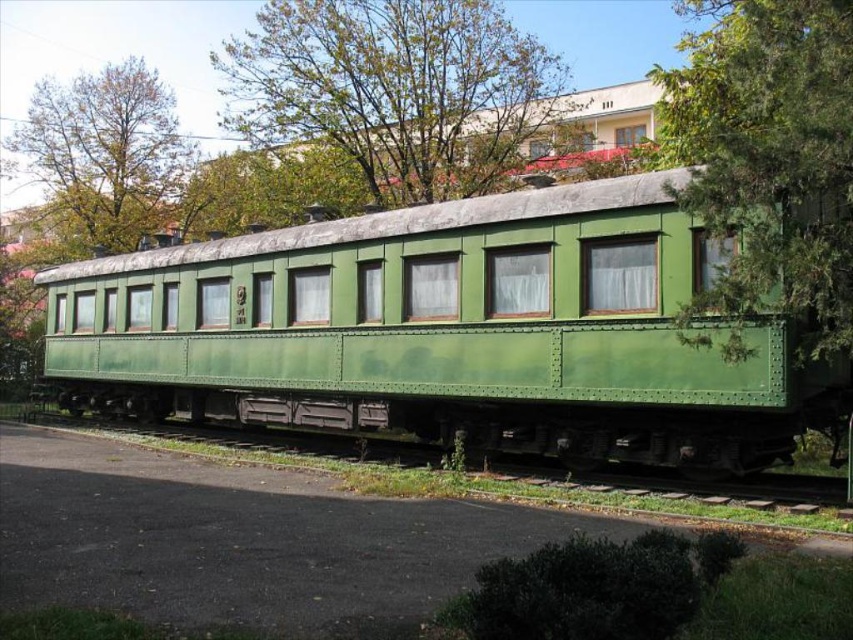
Between green matte train car at center and green leafy tree at upper left, which one has less height?

green matte train car at center is shorter.

Can you confirm if green matte train car at center is taller than green leafy tree at upper left?

In fact, green matte train car at center may be shorter than green leafy tree at upper left.

Who is more distant from viewer, (x=97, y=291) or (x=149, y=148)?

Positioned behind is point (x=149, y=148).

The height and width of the screenshot is (640, 853). I want to click on green matte train car at center, so click(448, 332).

Does green textured tree at upper right appear under green leafy tree at upper center?

Yes, green textured tree at upper right is below green leafy tree at upper center.

Is green textured tree at upper right positioned before green leafy tree at upper center?

Yes.

Does point (700, 58) come farther from viewer compared to point (509, 154)?

No, (700, 58) is in front of (509, 154).

Locate an element on the screen. Image resolution: width=853 pixels, height=640 pixels. green textured tree at upper right is located at coordinates (770, 157).

Which is more to the left, green textured tree at upper right or green leafy tree at upper left?

green leafy tree at upper left is more to the left.

Is the position of green textured tree at upper right more distant than that of green leafy tree at upper left?

No, it is in front of green leafy tree at upper left.

What do you see at coordinates (770, 157) in the screenshot? I see `green textured tree at upper right` at bounding box center [770, 157].

Locate an element on the screen. The height and width of the screenshot is (640, 853). green textured tree at upper right is located at coordinates (770, 157).